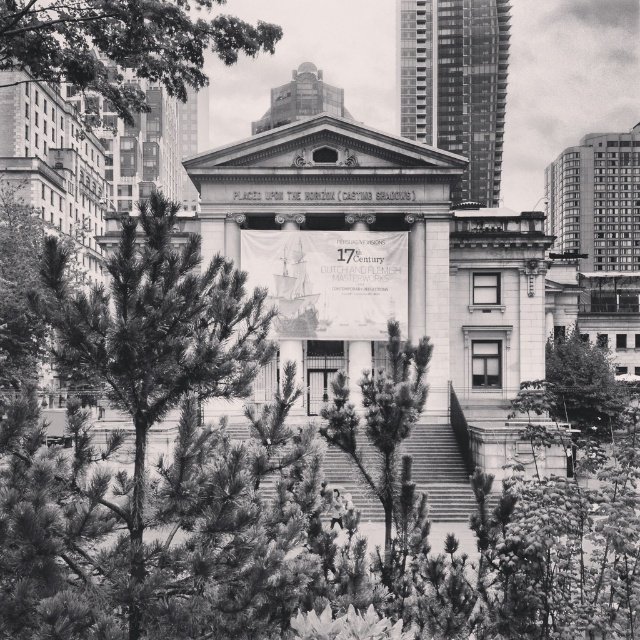
Is needle-like foliage at center thinner than needle-like pine at center?

No.

Does needle-like foliage at center come in front of needle-like pine at center?

Yes, needle-like foliage at center is in front of needle-like pine at center.

What do you see at coordinates (157, 330) in the screenshot?
I see `needle-like foliage at center` at bounding box center [157, 330].

The height and width of the screenshot is (640, 640). I want to click on needle-like foliage at center, so click(157, 330).

Does needle-like pine at center lie behind green leafy tree at center?

No, it is in front of green leafy tree at center.

Identify the location of needle-like pine at center. (385, 435).

Identify the location of needle-like pine at center. The width and height of the screenshot is (640, 640). (385, 435).

In the scene shown: Is green leafy tree at upper left positioned before needle-like pine at center?

That is False.

How much distance is there between green leafy tree at upper left and needle-like pine at center?

green leafy tree at upper left is 18.93 meters from needle-like pine at center.

Is point (12, 0) positioned before point (332, 433)?

No, it is behind (332, 433).

Image resolution: width=640 pixels, height=640 pixels. Find the location of `green leafy tree at upper left`. green leafy tree at upper left is located at coordinates point(124,44).